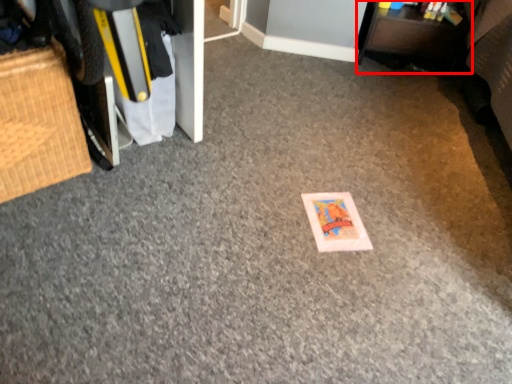
Question: From the image's perspective, where is furniture (annotated by the red box) located in relation to furniture in the image?

Choices:
 (A) above
 (B) below

Answer: (A)